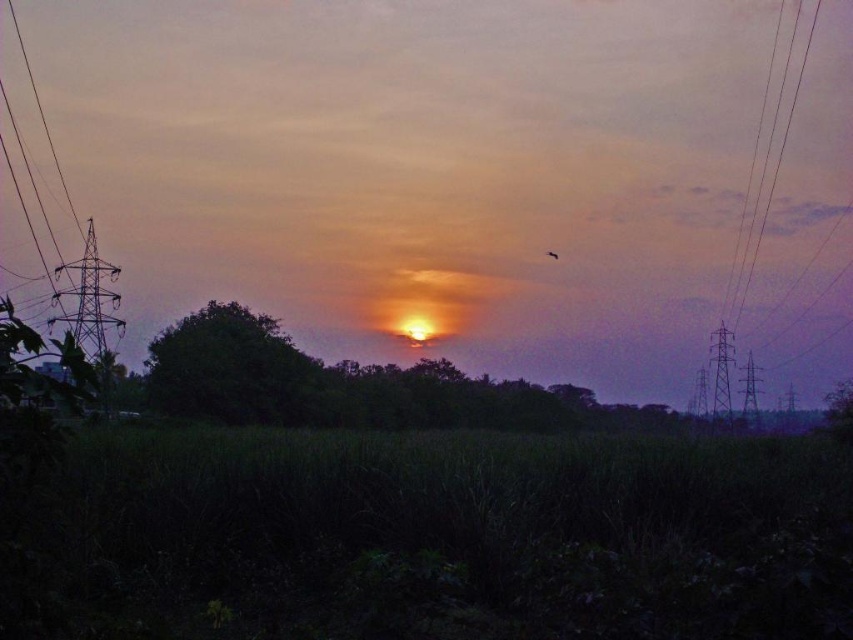
You are a photographer setting up a tripod to capture the sunset. You notice the metallic wire at right and the orange matte bird at center in your frame. Which object would appear wider in your photo?

The metallic wire at right appears wider than the orange matte bird at center because its width is larger.

You are a photographer trying to capture the orange matte bird at center in your shot. However, you notice the metallic wire at right is blocking your view. Can you adjust your position to avoid the wire while still keeping the bird in frame?

The metallic wire at right is in front of the orange matte bird at center, so moving your position to the left would allow you to position the bird in front of the wire, thus avoiding the obstruction.